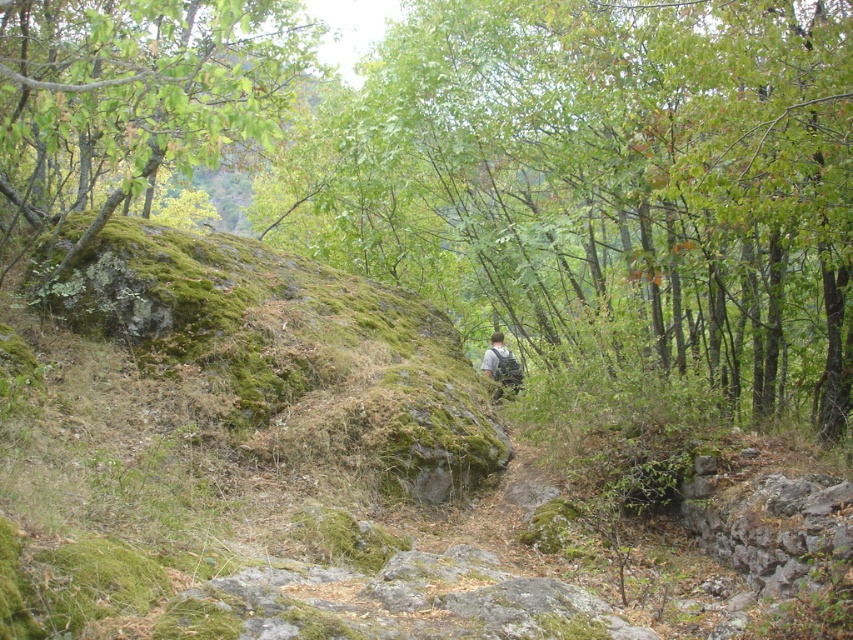
Does point (657, 67) come behind point (416, 470)?

Yes, point (657, 67) is behind point (416, 470).

Is point (824, 234) farther from viewer compared to point (425, 304)?

No, (824, 234) is closer to viewer.

At what (x,y) coordinates should I click in order to perform the action: click on green mossy rock at center. Please return your answer as a coordinate pair (x, y). This screenshot has width=853, height=640. Looking at the image, I should click on (604, 180).

Is green mossy rock at center positioned in front of green mossy rock at upper left?

No, it is behind green mossy rock at upper left.

Looking at this image, is green mossy rock at center bigger than green mossy rock at upper left?

No.

Does point (404, 198) come farther from viewer compared to point (192, 102)?

Yes, it is behind point (192, 102).

Identify the location of green mossy rock at center. (604, 180).

Who is positioned more to the left, green mossy rock at center or green fabric backpack at center?

Positioned to the left is green fabric backpack at center.

Is green mossy rock at center taller than green fabric backpack at center?

No, green mossy rock at center is not taller than green fabric backpack at center.

Image resolution: width=853 pixels, height=640 pixels. Identify the location of green mossy rock at center. (604, 180).